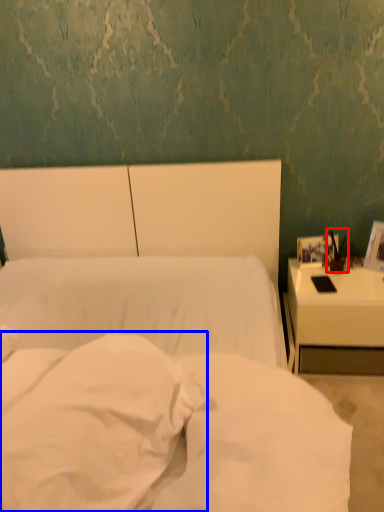
Question: Which of the following is the closest to the observer, bedside lamp (highlighted by a red box) or pillow (highlighted by a blue box)?

Choices:
 (A) bedside lamp
 (B) pillow

Answer: (B)